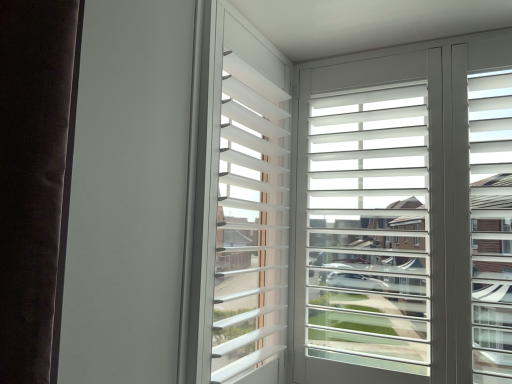
Question: Considering the relative sizes of white matte window screen at upper right and white matte blinds at center in the image provided, is white matte window screen at upper right thinner than white matte blinds at center?

Choices:
 (A) no
 (B) yes

Answer: (B)

Question: Would you consider white matte window screen at upper right to be distant from white matte blinds at center?

Choices:
 (A) no
 (B) yes

Answer: (A)

Question: Can you confirm if white matte window screen at upper right is smaller than white matte blinds at center?

Choices:
 (A) yes
 (B) no

Answer: (B)

Question: Is white matte window screen at upper right bigger than white matte blinds at center?

Choices:
 (A) no
 (B) yes

Answer: (B)

Question: Considering the relative sizes of white matte window screen at upper right and white matte blinds at center in the image provided, is white matte window screen at upper right shorter than white matte blinds at center?

Choices:
 (A) no
 (B) yes

Answer: (A)

Question: Is white matte window screen at upper right positioned with its back to white matte blinds at center?

Choices:
 (A) yes
 (B) no

Answer: (B)

Question: Is white matte blinds at center smaller than white matte window screen at upper right?

Choices:
 (A) no
 (B) yes

Answer: (B)

Question: From the image's perspective, would you say white matte blinds at center is positioned over white matte window screen at upper right?

Choices:
 (A) no
 (B) yes

Answer: (B)

Question: From a real-world perspective, is white matte blinds at center on top of white matte window screen at upper right?

Choices:
 (A) yes
 (B) no

Answer: (A)

Question: Would you say white matte blinds at center contains white matte window screen at upper right?

Choices:
 (A) no
 (B) yes

Answer: (A)

Question: Is white matte blinds at center shorter than white matte window screen at upper right?

Choices:
 (A) yes
 (B) no

Answer: (A)

Question: Can you confirm if white matte blinds at center is wider than white matte window screen at upper right?

Choices:
 (A) yes
 (B) no

Answer: (A)

Question: Do you think white matte window screen at upper right is within white matte blinds at center, or outside of it?

Choices:
 (A) inside
 (B) outside

Answer: (B)